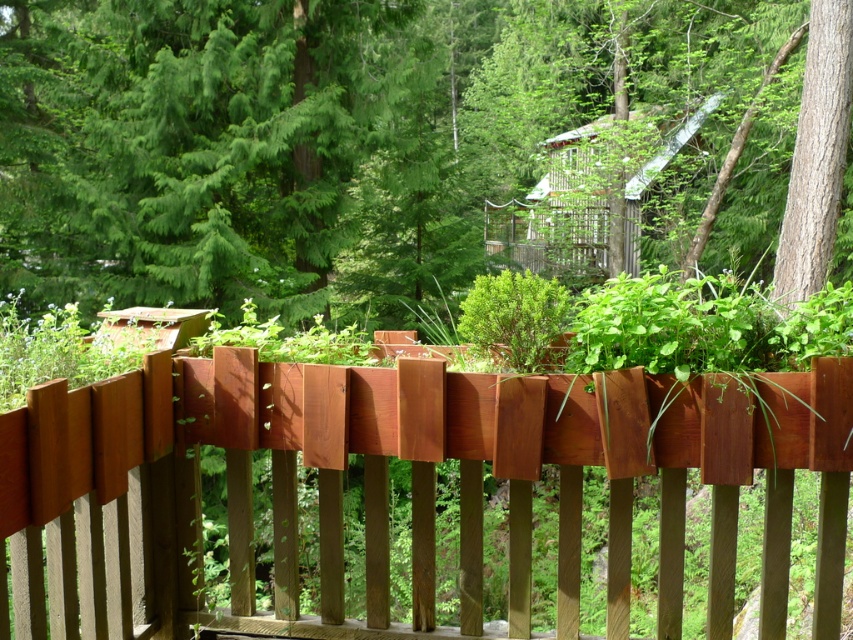
Between green matte tree at center and smooth brown tree trunk at right, which one is positioned lower?

smooth brown tree trunk at right is below.

Is point (526, 120) positioned in front of point (836, 145)?

That is False.

What do you see at coordinates (276, 144) in the screenshot?
I see `green matte tree at center` at bounding box center [276, 144].

Image resolution: width=853 pixels, height=640 pixels. I want to click on green matte tree at center, so click(276, 144).

Is point (618, 448) farther from camera compared to point (798, 134)?

No, (618, 448) is closer to viewer.

Can you confirm if cedar wood fence at center is positioned below smooth brown tree trunk at right?

Yes.

Who is more forward, (764, 588) or (804, 214)?

Positioned in front is point (764, 588).

Where is `cedar wood fence at center`? cedar wood fence at center is located at coordinates (433, 472).

Can you confirm if green matte tree at center is positioned above cedar wood fence at center?

Indeed, green matte tree at center is positioned over cedar wood fence at center.

Who is taller, green matte tree at center or cedar wood fence at center?

Standing taller between the two is green matte tree at center.

The width and height of the screenshot is (853, 640). What are the coordinates of `green matte tree at center` in the screenshot? It's located at (276, 144).